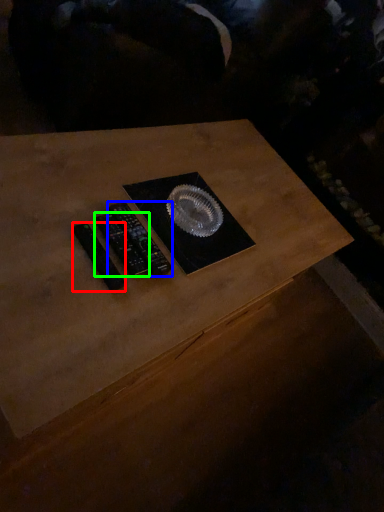
Question: Estimate the real-world distances between objects in this image. Which object is closer to control (highlighted by a red box), control (highlighted by a blue box) or control (highlighted by a green box)?

Choices:
 (A) control
 (B) control

Answer: (B)